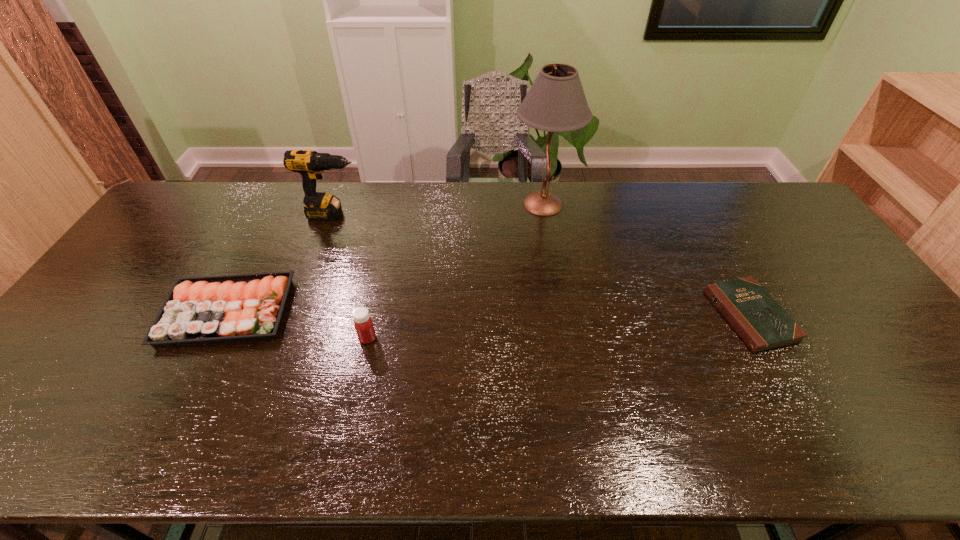
What are the coordinates of `free space between the third shortest object and the fourth object from left to right` in the screenshot? It's located at (455, 271).

Image resolution: width=960 pixels, height=540 pixels. Find the location of `blank region between the fourth tallest object and the second tallest object`. blank region between the fourth tallest object and the second tallest object is located at coordinates (280, 263).

This screenshot has width=960, height=540. In order to click on free space between the second shortest object and the second tallest object in this screenshot , I will do `click(280, 263)`.

Where is `the second closest object to the platter`? The image size is (960, 540). the second closest object to the platter is located at coordinates (310, 164).

Identify the location of the second closest object to the medicine. The height and width of the screenshot is (540, 960). tap(310, 164).

Where is `vacant space that satisfies the following two spatial constraints: 1. on the front-facing side of the shortest object; 2. on the left side of the second object from right to left`? This screenshot has width=960, height=540. vacant space that satisfies the following two spatial constraints: 1. on the front-facing side of the shortest object; 2. on the left side of the second object from right to left is located at coordinates (562, 316).

Identify the location of vacant area that satisfies the following two spatial constraints: 1. at the tip of the third object from left to right; 2. on the right side of the drill. (288, 338).

Find the location of a particular element. This screenshot has height=540, width=960. free location that satisfies the following two spatial constraints: 1. on the front-facing side of the second object from right to left; 2. on the front side of the platter is located at coordinates (561, 312).

Identify the location of vacant position in the image that satisfies the following two spatial constraints: 1. on the front-facing side of the tallest object; 2. on the front side of the platter. (561, 312).

Identify the location of vacant area in the image that satisfies the following two spatial constraints: 1. at the tip of the third object from right to left; 2. on the right side of the drill. click(x=288, y=338).